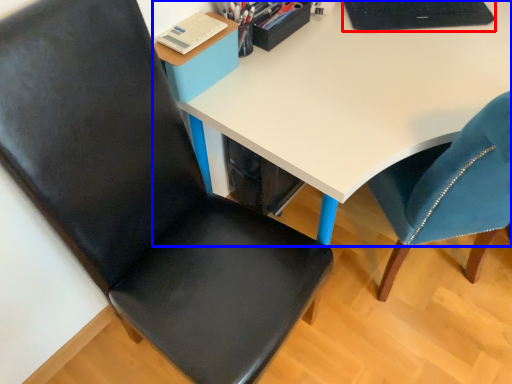
Question: Which point is further to the camera, laptop (highlighted by a red box) or desk (highlighted by a blue box)?

Choices:
 (A) laptop
 (B) desk

Answer: (A)